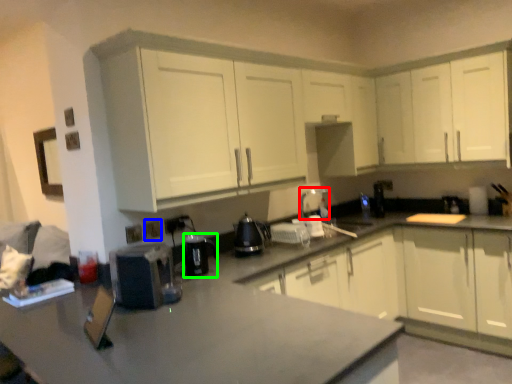
Question: Estimate the real-world distances between objects in this image. Which object is closer to appliance (highlighted by a red box), electric outlet (highlighted by a blue box) or appliance (highlighted by a green box)?

Choices:
 (A) electric outlet
 (B) appliance

Answer: (B)